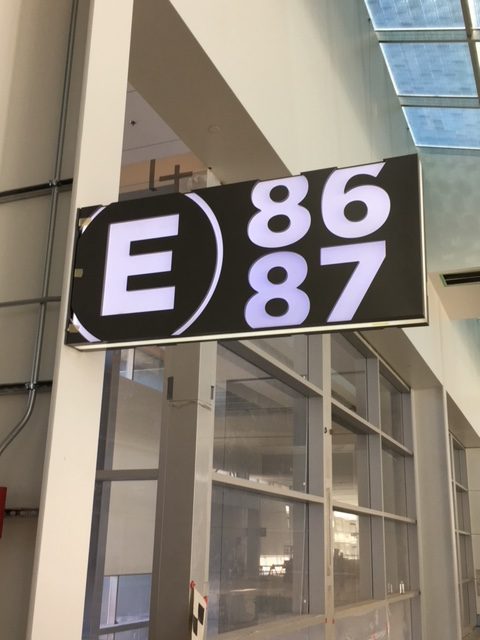
Identify the location of metal piping. Image resolution: width=480 pixels, height=640 pixels. (29, 408).